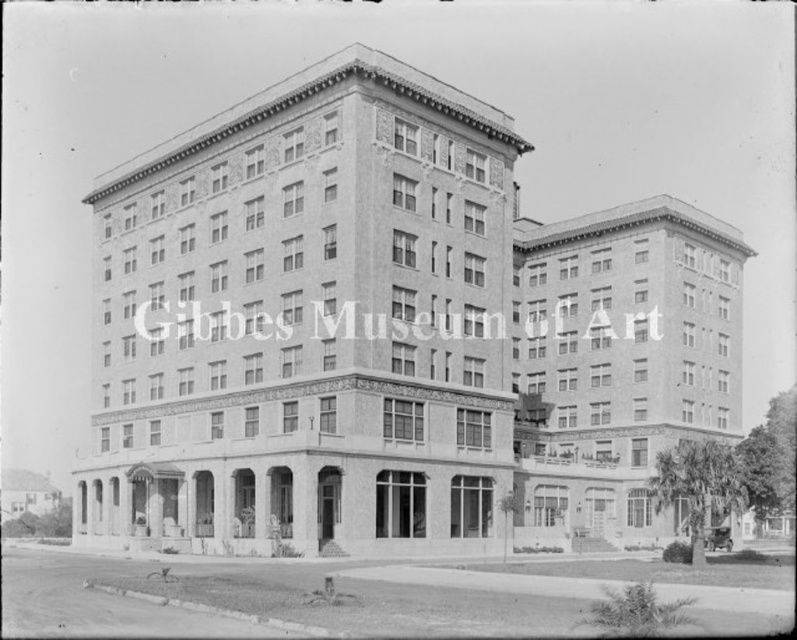
Question: Which object appears closest to the camera in this image?

Choices:
 (A) smooth stone building at center
 (B) brick textured building at center

Answer: (A)

Question: Which point is closer to the camera?

Choices:
 (A) (438, 284)
 (B) (587, 492)

Answer: (A)

Question: Is smooth stone building at center below brick textured building at center?

Choices:
 (A) yes
 (B) no

Answer: (B)

Question: Does smooth stone building at center have a lesser width compared to brick textured building at center?

Choices:
 (A) no
 (B) yes

Answer: (A)

Question: In this image, where is smooth stone building at center located relative to brick textured building at center?

Choices:
 (A) left
 (B) right

Answer: (A)